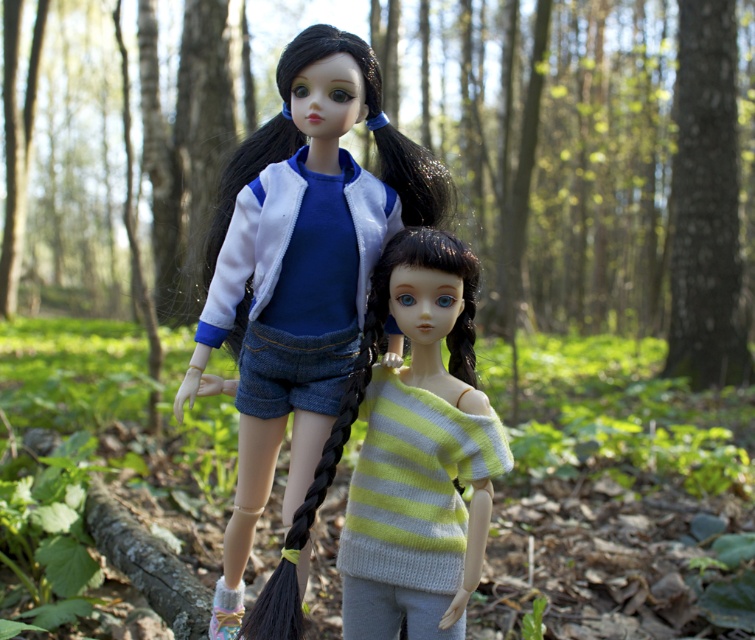
Which is behind, point (598, 65) or point (404, 292)?

The point (598, 65) is behind.

Is green leafy forest at center bigger than knitted yellow-green sweater at center?

Yes, green leafy forest at center is bigger than knitted yellow-green sweater at center.

Which is in front, point (669, 330) or point (361, 497)?

Positioned in front is point (361, 497).

This screenshot has height=640, width=755. Identify the location of green leafy forest at center. (604, 172).

Which of these two, green leafy forest at center or matte white jacket at center, stands taller?

green leafy forest at center is taller.

Does point (553, 76) come farther from viewer compared to point (284, 61)?

Yes, it is behind point (284, 61).

Where is `green leafy forest at center`? green leafy forest at center is located at coordinates (604, 172).

Does matte white jacket at center appear over knitted yellow-green sweater at center?

Correct, matte white jacket at center is located above knitted yellow-green sweater at center.

Who is shorter, matte white jacket at center or knitted yellow-green sweater at center?

With less height is knitted yellow-green sweater at center.

Does point (267, 413) lie in front of point (396, 548)?

No, (267, 413) is further to viewer.

In order to click on matte white jacket at center in this screenshot , I will do `click(300, 269)`.